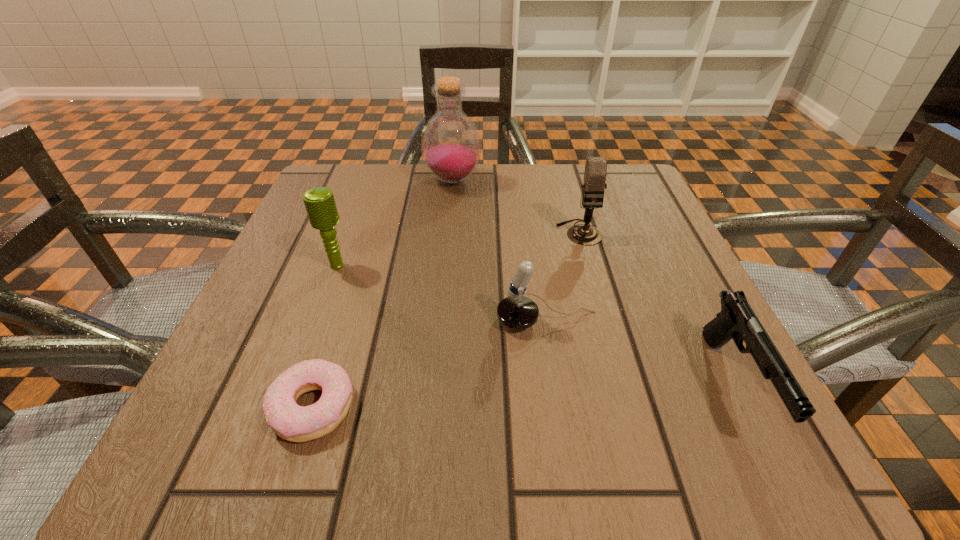
Where is `bottle`? The image size is (960, 540). bottle is located at coordinates [x=451, y=146].

Locate an element on the screen. This screenshot has width=960, height=540. the farthest object is located at coordinates (451, 146).

Where is `the farthest microphone`? Image resolution: width=960 pixels, height=540 pixels. the farthest microphone is located at coordinates (595, 172).

Locate an element on the screen. The width and height of the screenshot is (960, 540). the second farthest microphone is located at coordinates tap(319, 202).

Where is `the leftmost microphone`? The width and height of the screenshot is (960, 540). the leftmost microphone is located at coordinates 319,202.

Find the location of a particular element. The image size is (960, 540). the shortest microphone is located at coordinates (518, 312).

Where is `gun`? The image size is (960, 540). gun is located at coordinates (737, 321).

Identify the location of doughnut. The width and height of the screenshot is (960, 540). (294, 423).

The width and height of the screenshot is (960, 540). I want to click on free space located on the left of the tallest object, so click(x=398, y=181).

The width and height of the screenshot is (960, 540). I want to click on vacant area located 0.220m on the front-facing side of the second farthest object, so click(x=608, y=334).